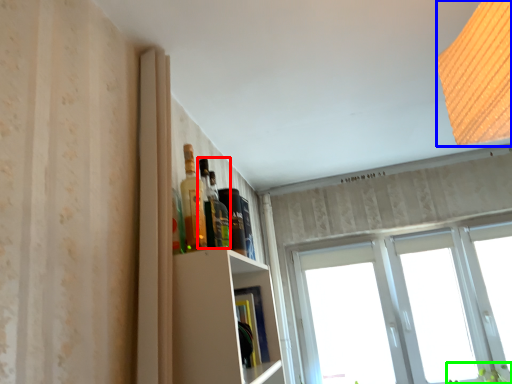
Question: Based on their relative distances, which object is nearer to bottle (highlighted by a red box)? Choose from light (highlighted by a blue box) and plant (highlighted by a green box).

Choices:
 (A) light
 (B) plant

Answer: (A)